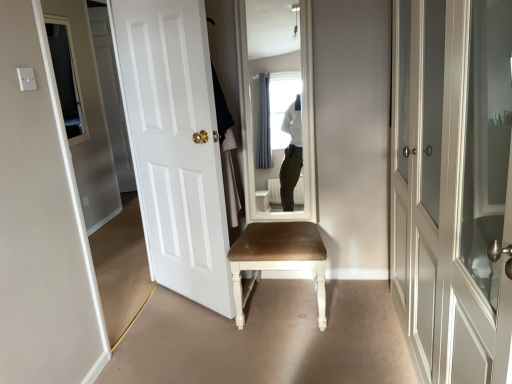
In order to click on matte gray wardrobe at right, the first door viewed from the right in this screenshot , I will do `click(452, 186)`.

The image size is (512, 384). What do you see at coordinates (226, 152) in the screenshot? I see `white cotton robe at center` at bounding box center [226, 152].

In the scene shown: What is the approximate width of white cotton robe at center?

6.75 inches.

At what (x,y) coordinates should I click in order to perform the action: click on matte gray wardrobe at right, the first door viewed from the right. Please return your answer as a coordinate pair (x, y). Looking at the image, I should click on (452, 186).

Considering the sizes of objects white matte door at left, arranged as the third door when viewed from the right, and brown leather chair at center in the image provided, who is thinner, white matte door at left, arranged as the third door when viewed from the right, or brown leather chair at center?

Thinner between the two is white matte door at left, arranged as the third door when viewed from the right.

Is white matte door at left, acting as the 1th door starting from the left, at the left side of brown leather chair at center?

Correct, you'll find white matte door at left, acting as the 1th door starting from the left, to the left of brown leather chair at center.

From the image's perspective, which door is the 2nd one above the brown leather chair at center? Please provide its 2D coordinates.

[(41, 223)]

Is white matte door at left, acting as the 1th door starting from the left, placed right next to brown leather chair at center?

No, white matte door at left, acting as the 1th door starting from the left, is not with brown leather chair at center.

Considering the sizes of objects matte gray wardrobe at right, which is the 3th door in left-to-right order, and brown leather chair at center in the image provided, who is wider, matte gray wardrobe at right, which is the 3th door in left-to-right order, or brown leather chair at center?

With larger width is matte gray wardrobe at right, which is the 3th door in left-to-right order.

From a real-world perspective, which is physically below, matte gray wardrobe at right, which is the 3th door in left-to-right order, or brown leather chair at center?

In real-world perspective, brown leather chair at center is lower.

How many degrees apart are the facing directions of matte gray wardrobe at right, the first door viewed from the right, and brown leather chair at center?

There is a 92.7-degree angle between the facing directions of matte gray wardrobe at right, the first door viewed from the right, and brown leather chair at center.

Is matte gray wardrobe at right, the first door viewed from the right, looking in the opposite direction of brown leather chair at center?

No, matte gray wardrobe at right, the first door viewed from the right,'s orientation is not away from brown leather chair at center.

Is brown leather chair at center beside white cotton robe at center?

brown leather chair at center and white cotton robe at center are clearly separated.

Based on the photo, which of these two, brown leather chair at center or white cotton robe at center, is bigger?

Bigger between the two is brown leather chair at center.

From the image's perspective, is brown leather chair at center located above or below white cotton robe at center?

From the image's perspective, brown leather chair at center appears below white cotton robe at center.

Considering the sizes of objects brown leather chair at center and matte gray wardrobe at right, the first door viewed from the right, in the image provided, who is shorter, brown leather chair at center or matte gray wardrobe at right, the first door viewed from the right,?

brown leather chair at center.

Between point (237, 306) and point (463, 78), which one is positioned behind?

The point (237, 306) is behind.

Is brown leather chair at center situated inside matte gray wardrobe at right, which is the 3th door in left-to-right order, or outside?

brown leather chair at center cannot be found inside matte gray wardrobe at right, which is the 3th door in left-to-right order.

Which is behind, point (210, 137) or point (506, 125)?

The point (210, 137) is more distant.

Choose the correct answer: Is white painted wood door at center, which appears as the second door when viewed from the right, inside matte gray wardrobe at right, the first door viewed from the right, or outside it?

white painted wood door at center, which appears as the second door when viewed from the right, cannot be found inside matte gray wardrobe at right, the first door viewed from the right.

What's the angular difference between white painted wood door at center, the 2th door from the left, and matte gray wardrobe at right, the first door viewed from the right,'s facing directions?

The angle between the facing direction of white painted wood door at center, the 2th door from the left, and the facing direction of matte gray wardrobe at right, the first door viewed from the right, is 56.3 degrees.

I want to click on door on the right side of white painted wood door at center, the 2th door from the left, so click(x=452, y=186).

Are white cotton robe at center and white matte door at left, arranged as the third door when viewed from the right, located far from each other?

white cotton robe at center is actually quite close to white matte door at left, arranged as the third door when viewed from the right.

Could you tell me if white cotton robe at center is turned towards white matte door at left, acting as the 1th door starting from the left?

No.

Would you say white cotton robe at center is outside white matte door at left, acting as the 1th door starting from the left?

Indeed, white cotton robe at center is completely outside white matte door at left, acting as the 1th door starting from the left.

Between point (140, 150) and point (251, 252), which one is positioned in front?

The point (251, 252) is closer.

Visually, is white painted wood door at center, the 2th door from the left, positioned to the left or to the right of brown leather chair at center?

In the image, white painted wood door at center, the 2th door from the left, appears on the left side of brown leather chair at center.

Considering the sizes of white painted wood door at center, which appears as the second door when viewed from the right, and brown leather chair at center in the image, is white painted wood door at center, which appears as the second door when viewed from the right, wider or thinner than brown leather chair at center?

white painted wood door at center, which appears as the second door when viewed from the right, is thinner than brown leather chair at center.

Which object is closer to the camera taking this photo, white painted wood door at center, the 2th door from the left, or brown leather chair at center?

white painted wood door at center, the 2th door from the left, is in front.

Image resolution: width=512 pixels, height=384 pixels. In the image, there is a white matte door at left, acting as the 1th door starting from the left. What are the coordinates of `chair below it (from a real-world perspective)` in the screenshot? It's located at (278, 259).

I want to click on chair on the left of the matte gray wardrobe at right, which is the 3th door in left-to-right order, so click(x=278, y=259).

Estimate the real-world distances between objects in this image. Which object is closer to white painted wood door at center, which appears as the second door when viewed from the right, brown leather chair at center or white cotton robe at center?

white cotton robe at center is closer to white painted wood door at center, which appears as the second door when viewed from the right.

Looking at the image, which one is located further to white painted wood door at center, the 2th door from the left, matte gray wardrobe at right, which is the 3th door in left-to-right order, or white matte door at left, acting as the 1th door starting from the left?

matte gray wardrobe at right, which is the 3th door in left-to-right order, lies further to white painted wood door at center, the 2th door from the left, than the other object.

From the image, which object appears to be nearer to matte gray wardrobe at right, the first door viewed from the right, brown leather chair at center or white painted wood door at center, the 2th door from the left?

Based on the image, brown leather chair at center appears to be nearer to matte gray wardrobe at right, the first door viewed from the right.

Looking at the image, which one is located closer to white painted wood door at center, which appears as the second door when viewed from the right, matte gray wardrobe at right, the first door viewed from the right, or white cotton robe at center?

white cotton robe at center is positioned closer to the anchor white painted wood door at center, which appears as the second door when viewed from the right.

Looking at the image, which one is located further to white cotton robe at center, white matte door at left, acting as the 1th door starting from the left, or matte gray wardrobe at right, the first door viewed from the right?

Among the two, matte gray wardrobe at right, the first door viewed from the right, is located further to white cotton robe at center.

Which object lies nearer to the anchor point matte gray wardrobe at right, which is the 3th door in left-to-right order, white matte door at left, arranged as the third door when viewed from the right, or white painted wood door at center, which appears as the second door when viewed from the right?

white painted wood door at center, which appears as the second door when viewed from the right.

Estimate the real-world distances between objects in this image. Which object is further from white painted wood door at center, the 2th door from the left, white cotton robe at center or brown leather chair at center?

The object further to white painted wood door at center, the 2th door from the left, is brown leather chair at center.

Which object lies further to the anchor point white cotton robe at center, white painted wood door at center, the 2th door from the left, or matte gray wardrobe at right, the first door viewed from the right?

matte gray wardrobe at right, the first door viewed from the right, lies further to white cotton robe at center than the other object.

The height and width of the screenshot is (384, 512). What are the coordinates of `robe between white painted wood door at center, which appears as the second door when viewed from the right, and brown leather chair at center, in the horizontal direction` in the screenshot? It's located at (226, 152).

Image resolution: width=512 pixels, height=384 pixels. I want to click on robe between white matte door at left, acting as the 1th door starting from the left, and matte gray wardrobe at right, which is the 3th door in left-to-right order, in the horizontal direction, so tap(226, 152).

Where is `door situated between white matte door at left, acting as the 1th door starting from the left, and brown leather chair at center from left to right`? The image size is (512, 384). door situated between white matte door at left, acting as the 1th door starting from the left, and brown leather chair at center from left to right is located at coordinates (175, 145).

You are a GUI agent. You are given a task and a screenshot of the screen. Output one action in this format:
    pyautogui.click(x=<x>, y=<y>)
    Task: Click on the chair between white matte door at left, acting as the 1th door starting from the left, and matte gray wardrobe at right, the first door viewed from the right, in the horizontal direction
    
    Given the screenshot: What is the action you would take?
    pyautogui.click(x=278, y=259)